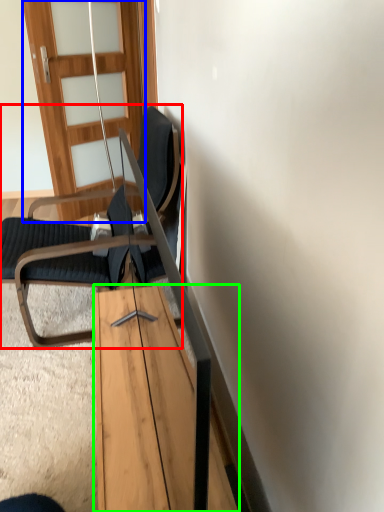
Question: Considering the real-world distances, which object is farthest from chair (highlighted by a red box)? door (highlighted by a blue box) or table (highlighted by a green box)?

Choices:
 (A) door
 (B) table

Answer: (A)